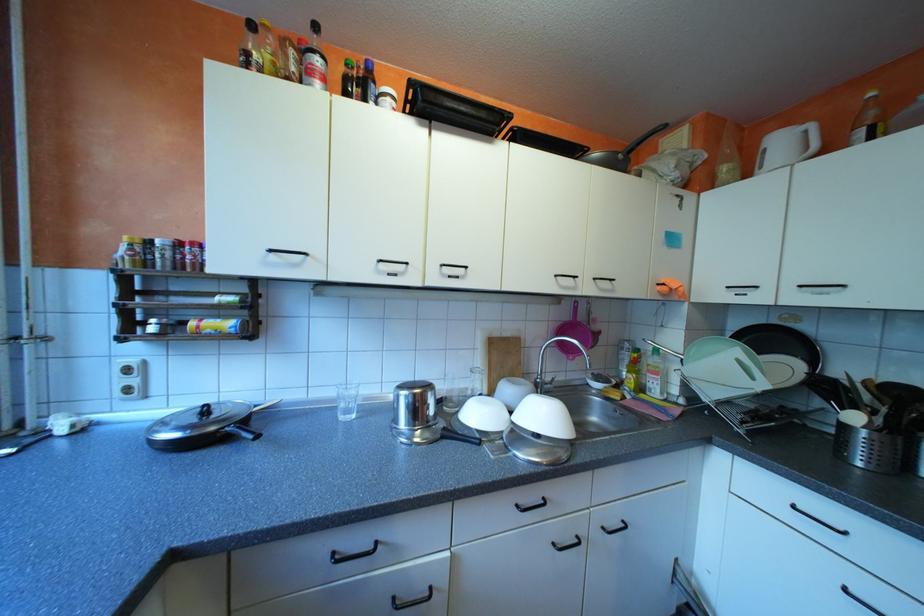
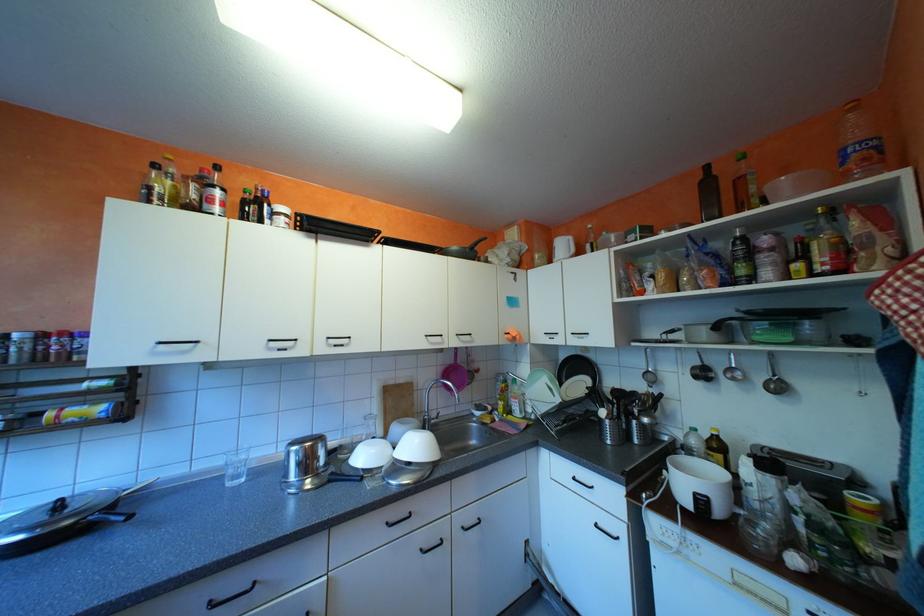
Find the pixel in the second image that matches point (227, 430) in the first image.

(88, 522)